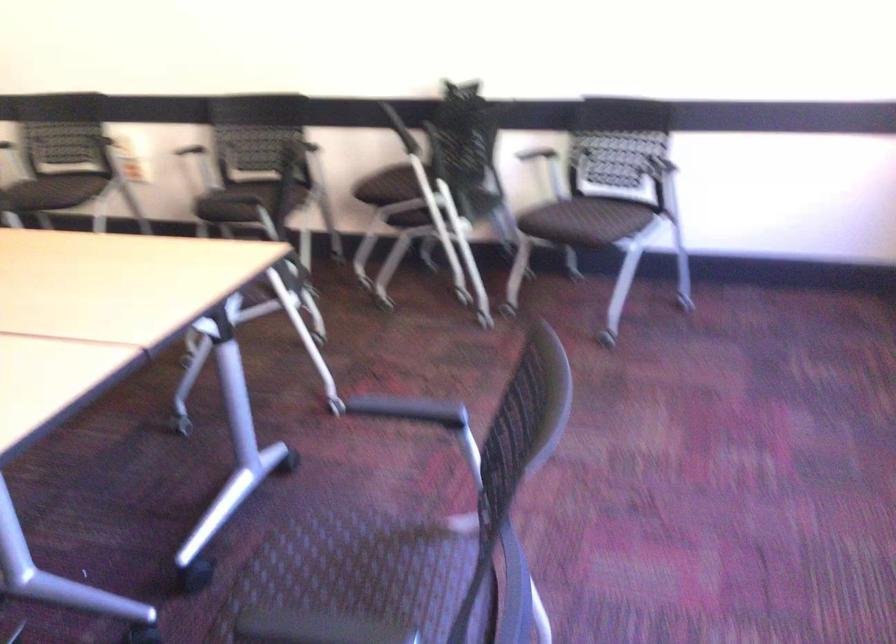
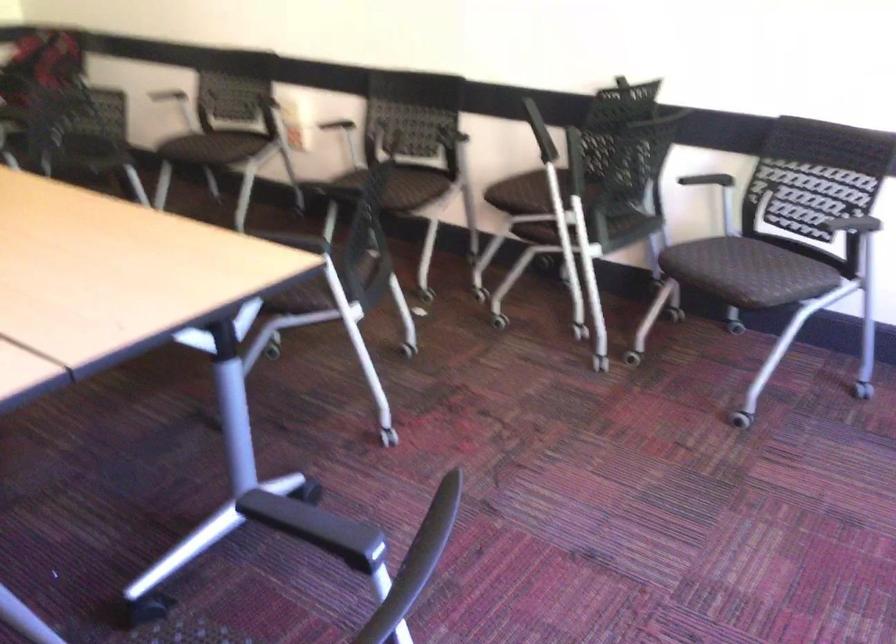
In the second image, find the point that corresponds to pixel 604 218 in the first image.

(764, 272)